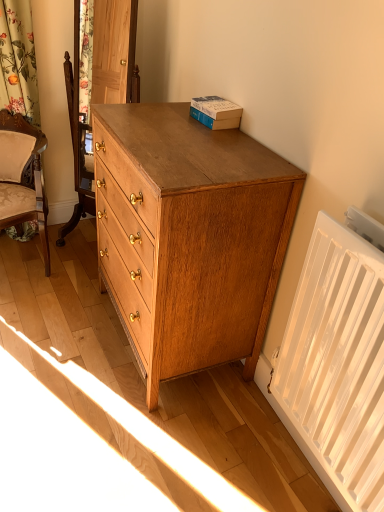
Where is `vacant region to the right of beige upholstered chair at left`? The image size is (384, 512). vacant region to the right of beige upholstered chair at left is located at coordinates (81, 282).